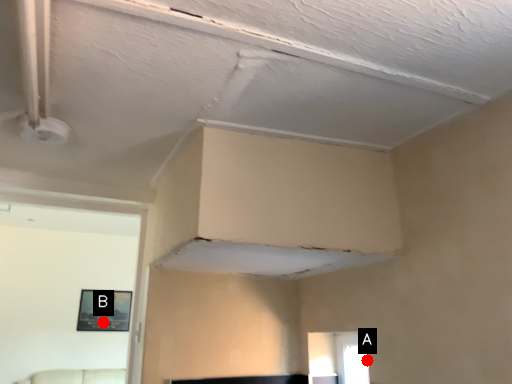
Question: Two points are circled on the image, labeled by A and B beside each circle. Which point is closer to the camera?

Choices:
 (A) A is closer
 (B) B is closer

Answer: (A)